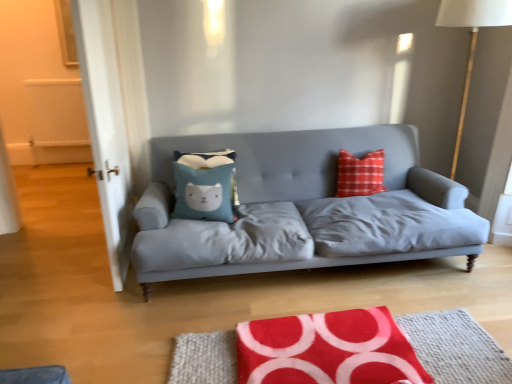
Where is `vacant space situated on the left part of red fabric rug at lower center`? The image size is (512, 384). vacant space situated on the left part of red fabric rug at lower center is located at coordinates (134, 318).